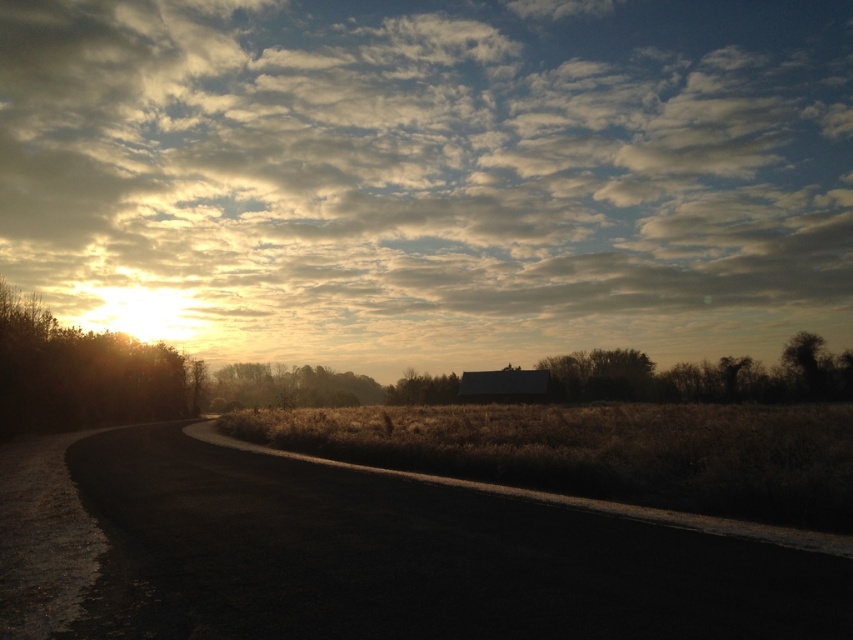
You are standing on the road and looking towards the brown matte tree at center. Which direction should you look to see the cloudy sky at upper center?

The cloudy sky at upper center is positioned on the left side of brown matte tree at center, so you should look to your left to see the cloudy sky at upper center.

You are a photographer wanting to capture the reflection of the sky in the wet road. You notice the brown grass at center and the brown matte tree at center. Which object is closer to the road surface, making its reflection more likely to be visible in the road?

The brown grass at center is taller than the brown matte tree at center, so the brown matte tree at center is closer to the road surface. Therefore, its reflection would be more likely visible in the road.